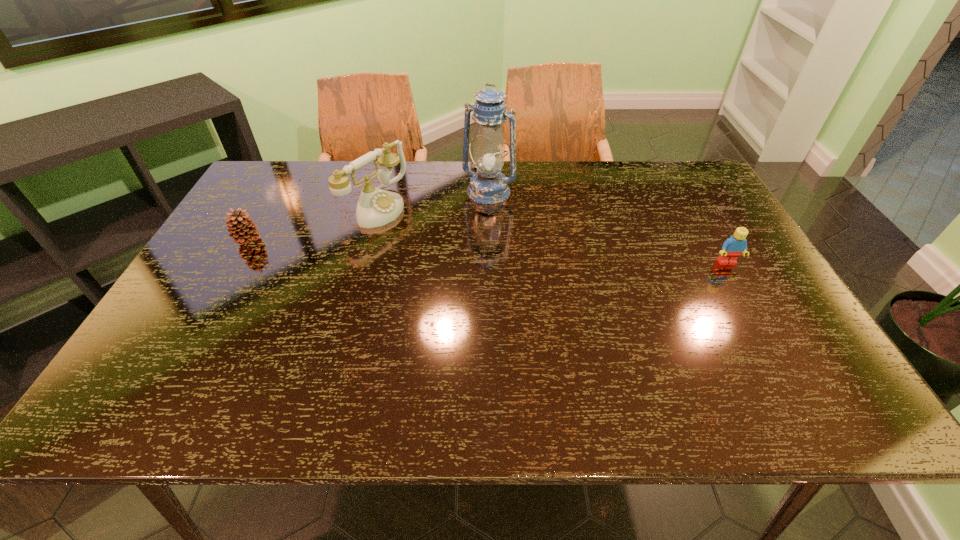
I want to click on blank space located on the front-facing side of the lantern, so click(x=470, y=217).

Where is `vacant space located 0.350m on the front-facing side of the lantern`? The width and height of the screenshot is (960, 540). vacant space located 0.350m on the front-facing side of the lantern is located at coordinates (429, 279).

Locate an element on the screen. free space located 0.060m on the front-facing side of the lantern is located at coordinates (472, 215).

Identify the location of free region located on the dial of the telephone. (458, 251).

You are a GUI agent. You are given a task and a screenshot of the screen. Output one action in this format:
    pyautogui.click(x=<x>, y=<y>)
    Task: Click on the free region located 0.140m on the dial of the telephone
    
    Given the screenshot: What is the action you would take?
    pyautogui.click(x=433, y=239)

What are the coordinates of `vacant region located 0.200m on the dial of the telephone` in the screenshot? It's located at (449, 247).

Find the location of `lantern located at the far edge`. lantern located at the far edge is located at coordinates (488, 186).

At what (x,y) coordinates should I click in order to perform the action: click on telephone positioned at the far edge. Please return your answer as a coordinate pair (x, y). Looking at the image, I should click on (376, 207).

The height and width of the screenshot is (540, 960). I want to click on object located at the left edge, so click(241, 227).

The height and width of the screenshot is (540, 960). In order to click on object at the right edge in this screenshot , I will do tap(734, 246).